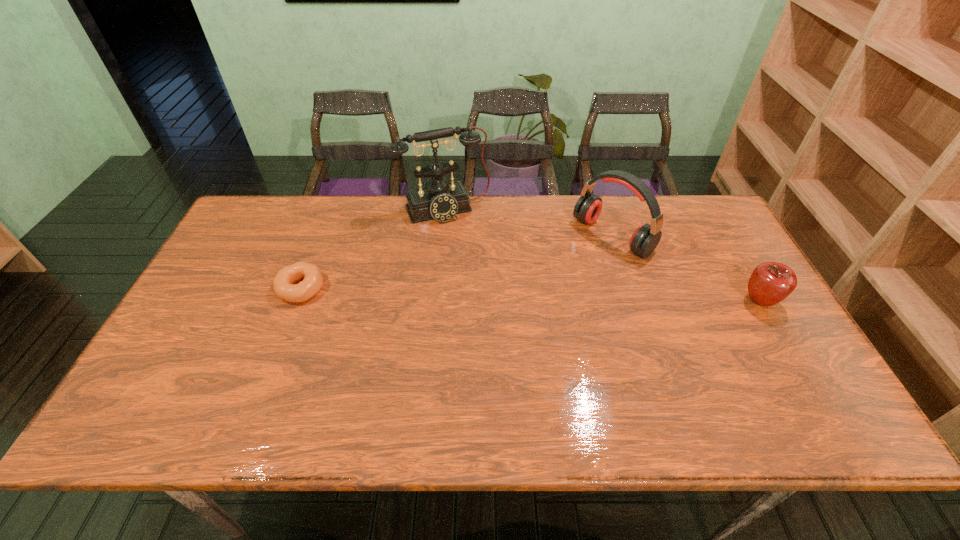
The height and width of the screenshot is (540, 960). I want to click on vacant space located 0.170m on the ear cups of the earphone, so click(551, 282).

This screenshot has width=960, height=540. I want to click on free space located on the ear cups of the earphone, so click(x=500, y=319).

Locate an element on the screen. free location located 0.110m on the ear cups of the earphone is located at coordinates pyautogui.click(x=564, y=272).

Image resolution: width=960 pixels, height=540 pixels. I want to click on free spot located 0.260m on the dial of the third object from right to left, so click(486, 279).

Where is `free location located on the dial of the third object from right to left`? free location located on the dial of the third object from right to left is located at coordinates (477, 260).

You are a GUI agent. You are given a task and a screenshot of the screen. Output one action in this format:
    pyautogui.click(x=<x>, y=<y>)
    Task: Click on the vacant space located 0.150m on the dial of the third object from right to left
    Image resolution: width=960 pixels, height=540 pixels.
    Given the screenshot: What is the action you would take?
    pyautogui.click(x=474, y=254)

I want to click on earphone present at the far edge, so click(645, 238).

Locate an element on the screen. The image size is (960, 540). telephone that is at the far edge is located at coordinates (441, 200).

Where is `object situated at the right edge`? The width and height of the screenshot is (960, 540). object situated at the right edge is located at coordinates (771, 282).

Locate an element on the screen. vacant region at the far edge of the desktop is located at coordinates (419, 225).